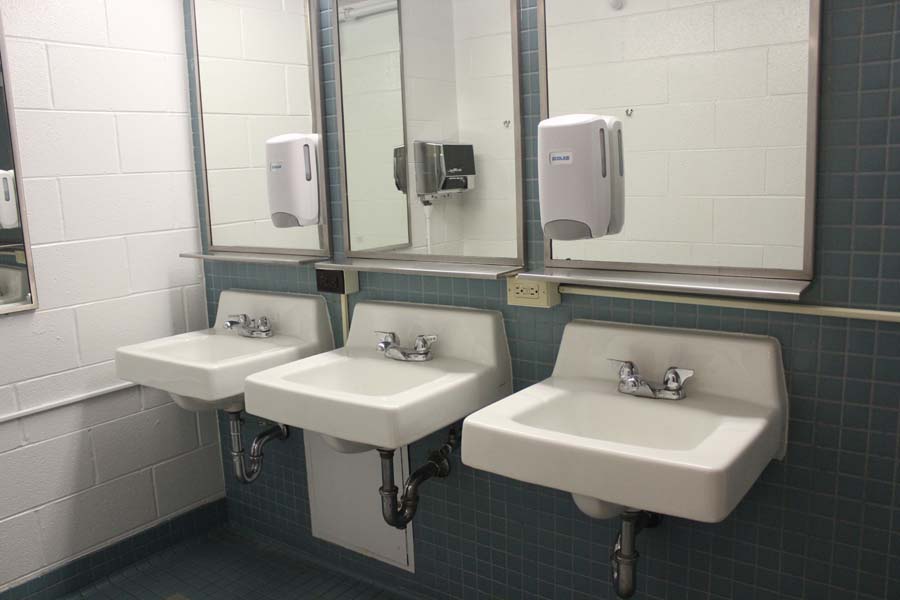
Find the location of a particular element. hot and cold water knobs is located at coordinates (387, 340), (421, 340), (622, 373), (677, 373), (262, 321), (234, 313).